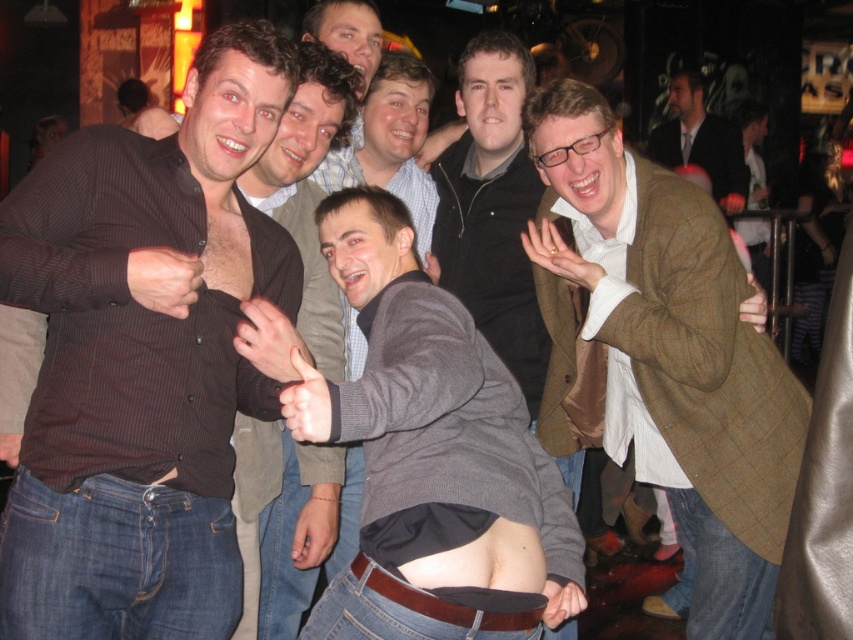
Question: Which point is farther to the camera?

Choices:
 (A) (547, 228)
 (B) (732, 202)
 (C) (508, 324)

Answer: (B)

Question: In this image, where is dark brown shirt at center located relative to gray sweater at center?

Choices:
 (A) right
 (B) left

Answer: (B)

Question: Considering the real-world distances, which object is farthest from the gray sweater at center?

Choices:
 (A) dark brown shirt at center
 (B) brown woolen blazer at right

Answer: (A)

Question: Is dark brown shirt at center to the right of brown woolen blazer at upper right from the viewer's perspective?

Choices:
 (A) no
 (B) yes

Answer: (A)

Question: Can you confirm if brown woolen blazer at right is smaller than dark brown shirt at center?

Choices:
 (A) yes
 (B) no

Answer: (B)

Question: Based on their relative distances, which object is nearer to the dark brown striped shirt at left?

Choices:
 (A) gray sweater at center
 (B) brown woolen blazer at upper right
 (C) dark brown shirt at center

Answer: (C)